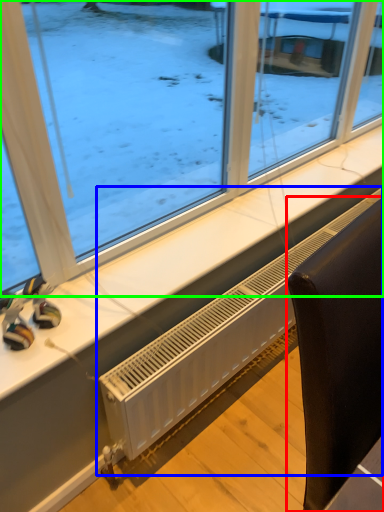
Question: Considering the real-world distances, which object is closest to furniture (highlighted by a red box)? air conditioning (highlighted by a blue box) or window (highlighted by a green box).

Choices:
 (A) air conditioning
 (B) window

Answer: (A)